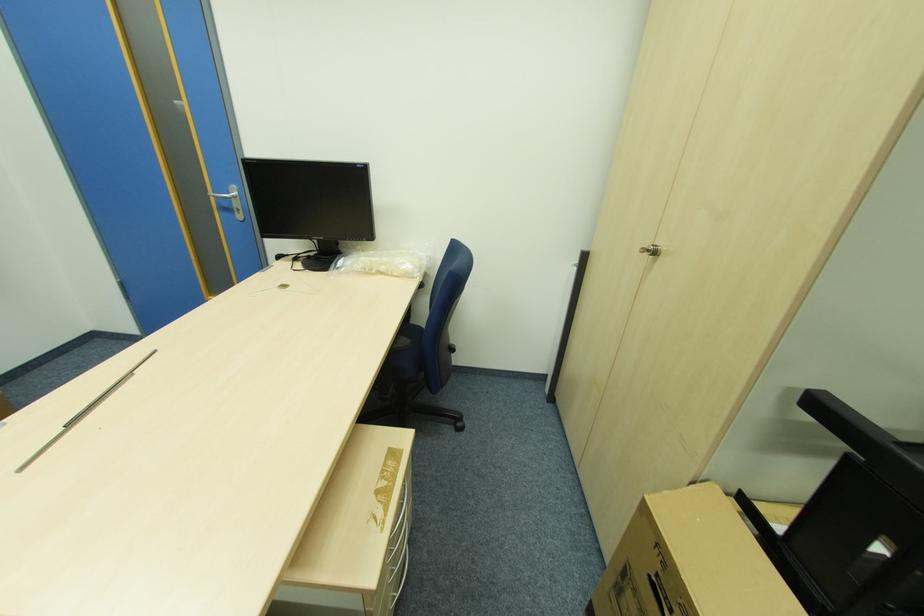
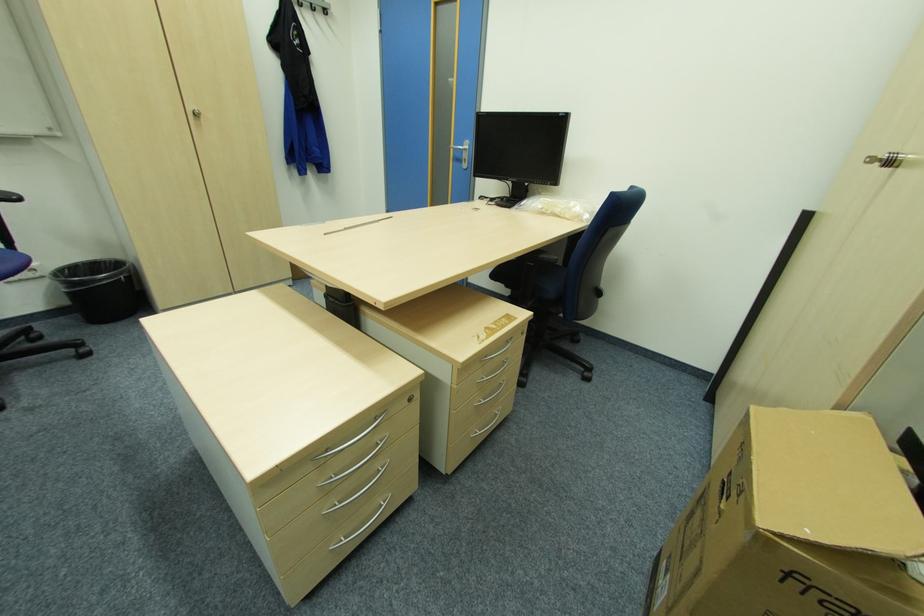
Question: The camera is either moving clockwise (left) or counter-clockwise (right) around the object. The first image is from the beginning of the video and the second image is from the end. Is the camera moving left or right when shooting the video?

Choices:
 (A) Left
 (B) Right

Answer: (B)